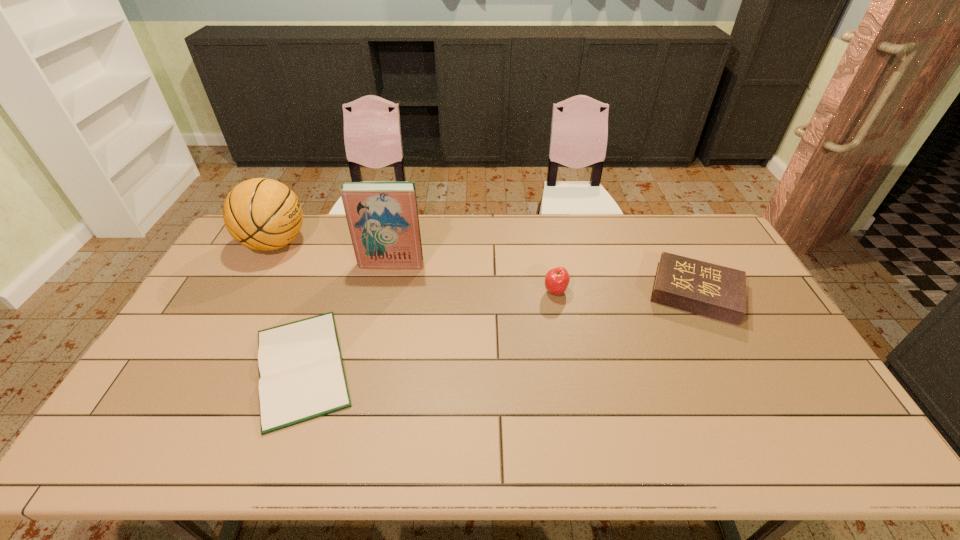
Identify the location of empty space that is in between the tallest object and the shortest hardback book. (347, 315).

You are a GUI agent. You are given a task and a screenshot of the screen. Output one action in this format:
    pyautogui.click(x=<x>, y=<y>)
    Task: Click on the vacant space that's between the shortest object and the tallest hardback book
    The width and height of the screenshot is (960, 540).
    Given the screenshot: What is the action you would take?
    pyautogui.click(x=347, y=315)

Point out which object is positioned as the second nearest to the tallest hardback book. Please provide its 2D coordinates. Your answer should be formatted as a tuple, i.e. [(x, y)], where the tuple contains the x and y coordinates of a point satisfying the conditions above.

[(301, 374)]

You are a GUI agent. You are given a task and a screenshot of the screen. Output one action in this format:
    pyautogui.click(x=<x>, y=<y>)
    Task: Click on the object that is the closest one to the fourth object from left to right
    
    Given the screenshot: What is the action you would take?
    pyautogui.click(x=714, y=291)

Point out which hardback book is positioned as the second nearest to the rightmost object. Please provide its 2D coordinates. Your answer should be formatted as a tuple, i.e. [(x, y)], where the tuple contains the x and y coordinates of a point satisfying the conditions above.

[(301, 374)]

This screenshot has width=960, height=540. Find the location of `hardback book that is the second closest to the tallest object`. hardback book that is the second closest to the tallest object is located at coordinates (714, 291).

You are a GUI agent. You are given a task and a screenshot of the screen. Output one action in this format:
    pyautogui.click(x=<x>, y=<y>)
    Task: Click on the free space in the image that satisfies the following two spatial constraints: 1. on the surface of the basketball near the brand logo; 2. on the left side of the third tallest object
    
    Given the screenshot: What is the action you would take?
    pyautogui.click(x=249, y=292)

Where is `vacant space that satisfies the following two spatial constraints: 1. on the surface of the basketball near the brand logo; 2. on the left side of the apple`? vacant space that satisfies the following two spatial constraints: 1. on the surface of the basketball near the brand logo; 2. on the left side of the apple is located at coordinates (249, 292).

At what (x,y) coordinates should I click in order to perform the action: click on free space that satisfies the following two spatial constraints: 1. on the back side of the second object from right to left; 2. on the surface of the basketball near the brand logo. Please return your answer as a coordinate pair (x, y). Looking at the image, I should click on (547, 243).

You are a GUI agent. You are given a task and a screenshot of the screen. Output one action in this format:
    pyautogui.click(x=<x>, y=<y>)
    Task: Click on the vacant region that satisfies the following two spatial constraints: 1. on the surface of the fourth shortest object near the brand logo; 2. on the left side of the fourth tallest object
    Image resolution: width=960 pixels, height=540 pixels.
    Given the screenshot: What is the action you would take?
    pyautogui.click(x=249, y=293)